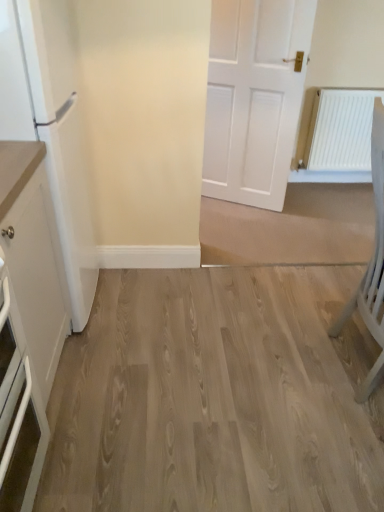
Identify the location of vacant area situated to the left side of light gray wooden chair at right. (271, 367).